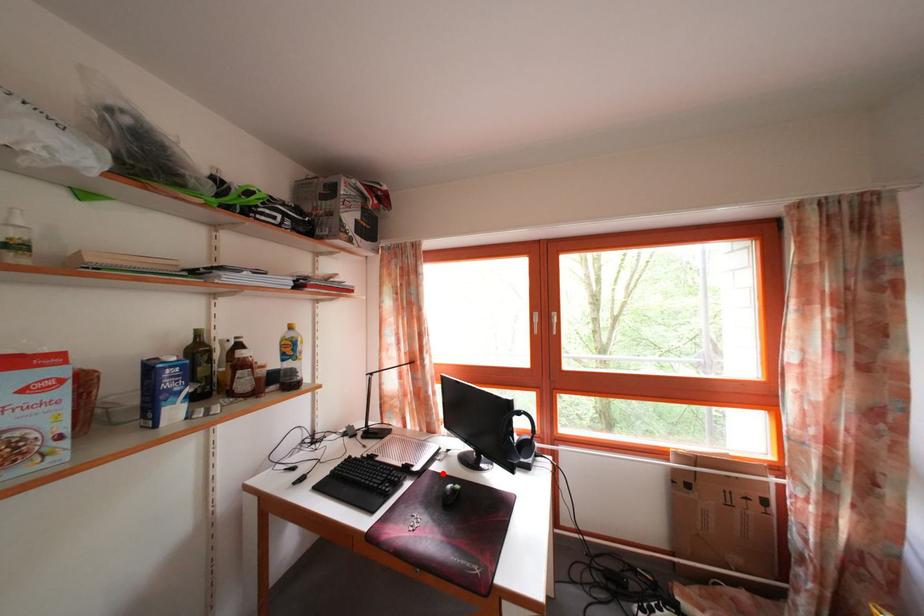
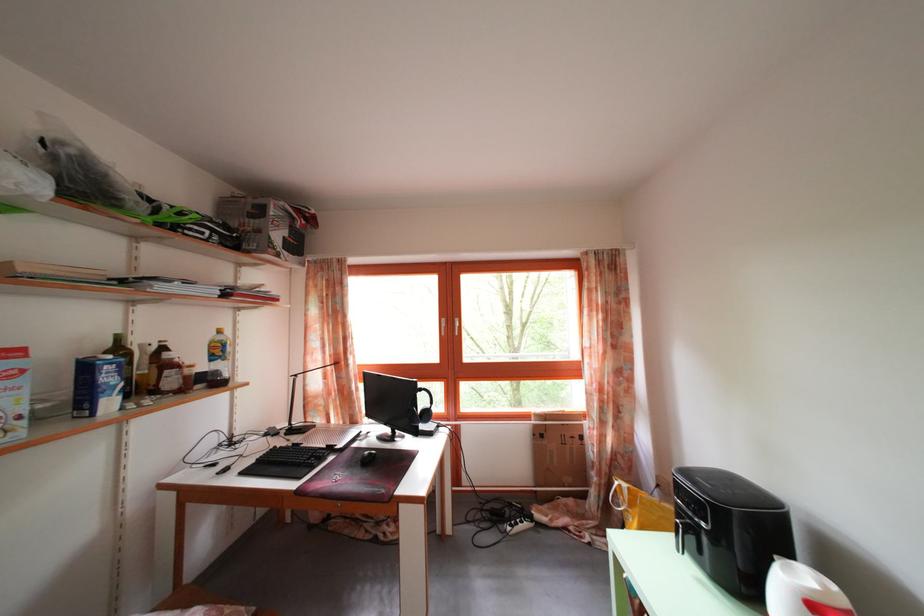
Question: I am providing you with two images of the same scene from different viewpoints. Given a red point in image1, look at the same physical point in image2. Is it:

Choices:
 (A) Closer to the viewpoint
 (B) Farther from the viewpoint

Answer: (B)